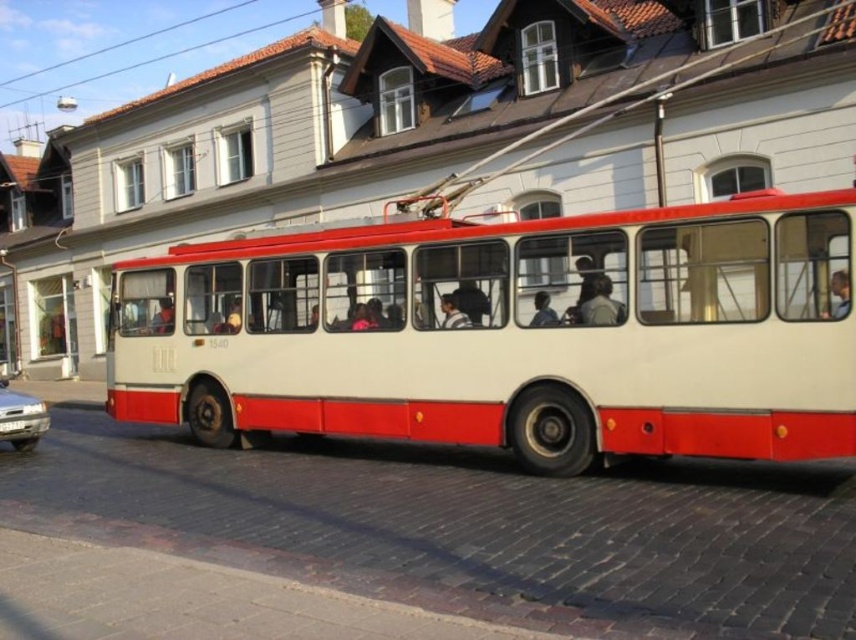
Does smooth beige jacket at center appear on the left side of smooth skin face at center?

Indeed, smooth beige jacket at center is positioned on the left side of smooth skin face at center.

Identify the location of smooth beige jacket at center. (599, 304).

Which is in front, point (39, 416) or point (444, 296)?

Positioned in front is point (444, 296).

From the picture: Does silver metallic car at lower left appear on the right side of matte plastic head at center?

In fact, silver metallic car at lower left is to the left of matte plastic head at center.

You are a GUI agent. You are given a task and a screenshot of the screen. Output one action in this format:
    pyautogui.click(x=<x>, y=<y>)
    Task: Click on the silver metallic car at lower left
    
    Given the screenshot: What is the action you would take?
    pyautogui.click(x=21, y=417)

I want to click on silver metallic car at lower left, so click(21, 417).

Is white matte bus at center smaller than silver metallic car at lower left?

Correct, white matte bus at center occupies less space than silver metallic car at lower left.

The height and width of the screenshot is (640, 856). What do you see at coordinates (507, 333) in the screenshot?
I see `white matte bus at center` at bounding box center [507, 333].

Which is in front, point (179, 394) or point (3, 404)?

Positioned in front is point (3, 404).

Identify the location of white matte bus at center. (507, 333).